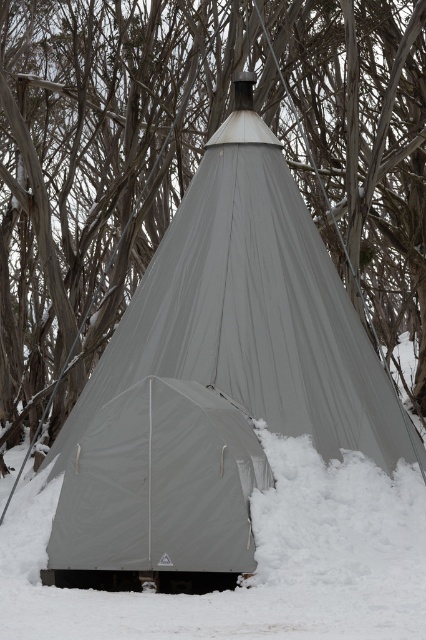
Question: Is the position of gray fabric tent at center more distant than that of matte gray tent at center?

Choices:
 (A) no
 (B) yes

Answer: (B)

Question: Does gray fabric tent at center have a larger size compared to matte gray tent at center?

Choices:
 (A) no
 (B) yes

Answer: (B)

Question: Where is gray fabric tent at center located in relation to matte gray tent at center in the image?

Choices:
 (A) left
 (B) right

Answer: (B)

Question: Which point is farther to the camera?

Choices:
 (A) matte gray tent at center
 (B) gray fabric tent at center

Answer: (B)

Question: Which point is closer to the camera taking this photo?

Choices:
 (A) (219, 109)
 (B) (245, 422)

Answer: (B)